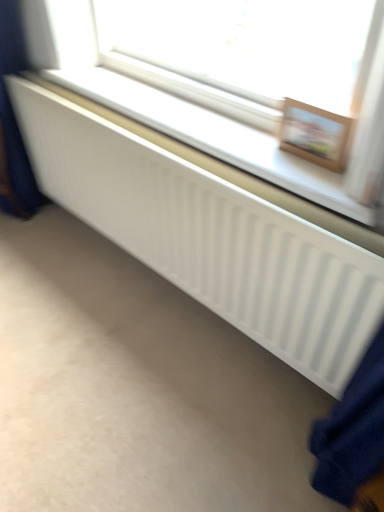
Where is `free location to the left of wooden picture frame at upper right`? This screenshot has height=512, width=384. free location to the left of wooden picture frame at upper right is located at coordinates (249, 150).